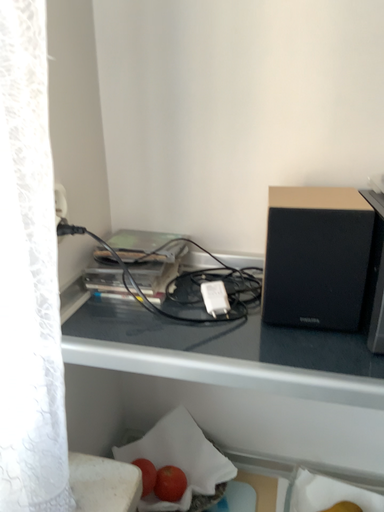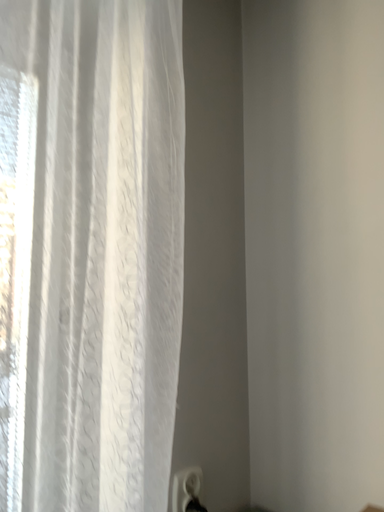
Question: Which way did the camera rotate in the video?

Choices:
 (A) rotated left
 (B) rotated right

Answer: (A)